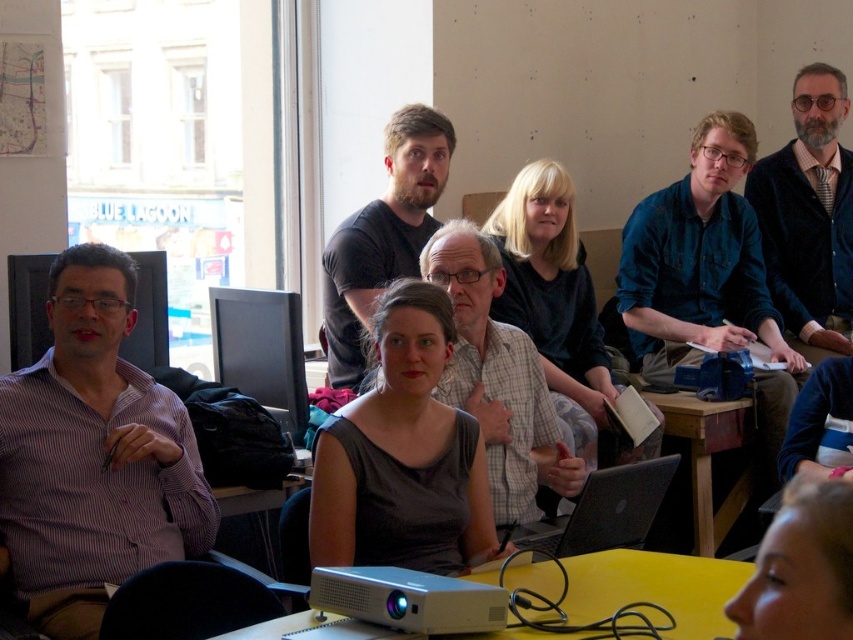
You are organizing a small workshop and need to seat two participants. You have a yellow matte table at lower center and a blonde hair at lower right. Which object can accommodate more people comfortably?

The yellow matte table at lower center is larger in size than blonde hair at lower right, so it can accommodate more people comfortably.

You are organizing a photo shoot and need to ensure that the blonde hair at lower right and the matte black computer at left are both visible in the frame. Based on their sizes, which object requires a wider shot to capture fully?

The blonde hair at lower right requires a wider shot to capture fully because its width surpasses that of the matte black computer at left.

You are a new attendee entering the room and need to find the person wearing the plaid shirt at center. Which direction should you look relative to the matte black monitor at center?

The plaid shirt at center is located below the matte black monitor at center, so you should look downward from the matte black monitor at center to find the person wearing the plaid shirt at center.